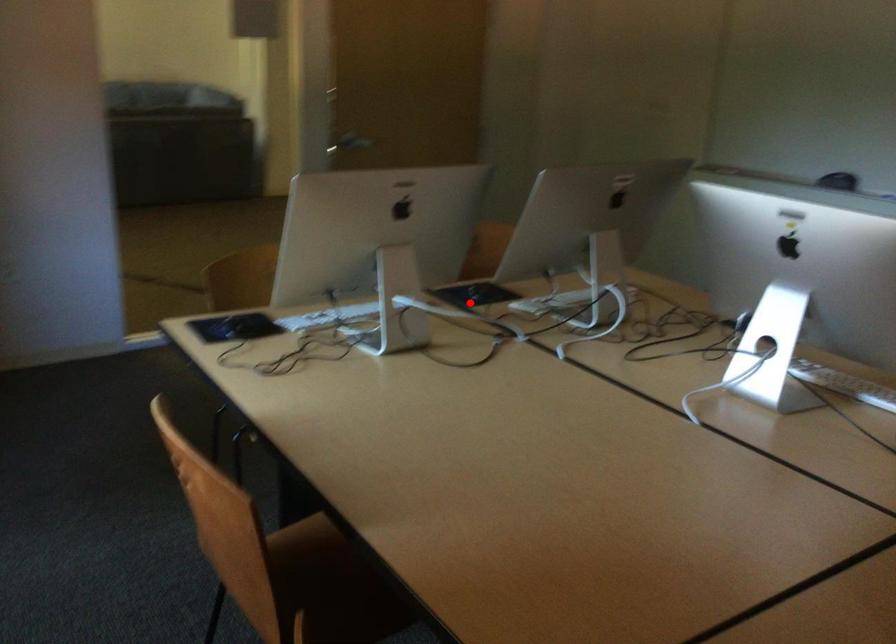
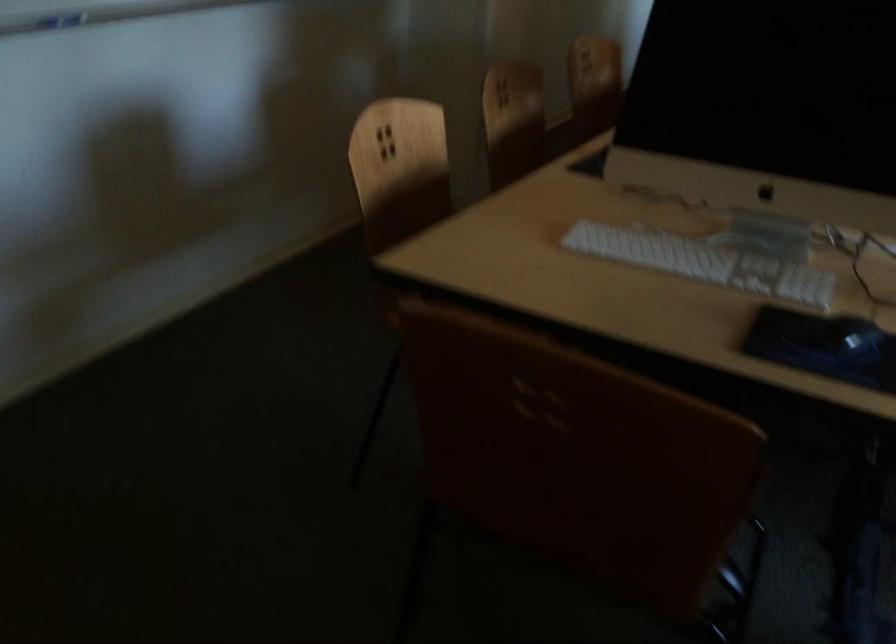
In the second image, find the point that corresponds to the highlighted location in the first image.

(860, 345)